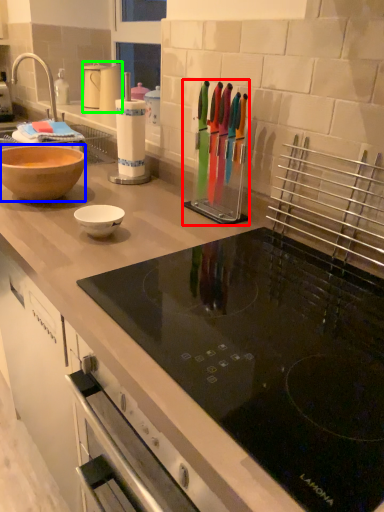
Question: Which object is positioned farthest from appliance (highlighted by a red box)? Select from bowl (highlighted by a blue box) and kitchen appliance (highlighted by a green box).

Choices:
 (A) bowl
 (B) kitchen appliance

Answer: (B)